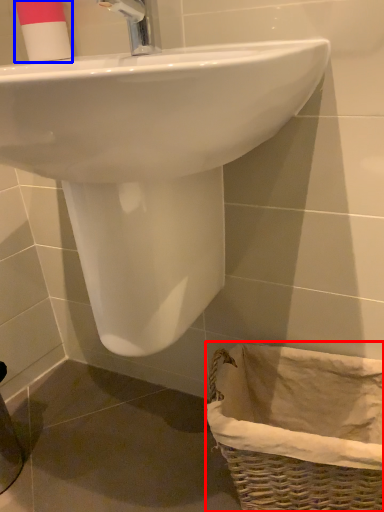
Question: Which object appears farthest to the camera in this image, basket (highlighted by a red box) or toiletry (highlighted by a blue box)?

Choices:
 (A) basket
 (B) toiletry

Answer: (B)